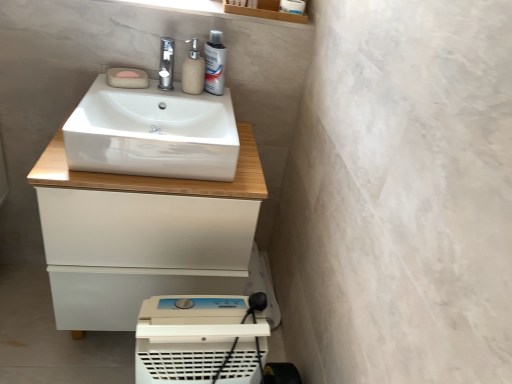
In the scene shown: Measure the distance between point (75, 160) and camera.

A distance of 1.11 meters exists between point (75, 160) and camera.

Describe the element at coordinates (156, 129) in the screenshot. Image resolution: width=512 pixels, height=384 pixels. I see `white glossy sink at center` at that location.

Locate an element on the screen. This screenshot has width=512, height=384. silver metallic mouthwash at upper center is located at coordinates (214, 63).

In order to face beige matte soap at upper left, the first soap when ordered from top to bottom, should I rotate leftwards or rightwards?

Turn left approximately 17.131 degrees to face it.

Image resolution: width=512 pixels, height=384 pixels. What do you see at coordinates (193, 71) in the screenshot?
I see `matte beige soap dispenser at upper center` at bounding box center [193, 71].

What is the approximate width of white plastic air purifier at lower center?

It is 9.65 inches.

Describe the element at coordinates (136, 235) in the screenshot. I see `white glossy cabinet at center` at that location.

Where is `white glossy cabinet at center`? This screenshot has height=384, width=512. white glossy cabinet at center is located at coordinates (136, 235).

I want to click on satin nickel faucet at upper center, so click(x=166, y=64).

Considering the positions of objects white glossy sink at center and pink felt soap at upper left, which is the 2th soap in top-to-bottom order, in the image provided, who is more to the right, white glossy sink at center or pink felt soap at upper left, which is the 2th soap in top-to-bottom order,?

Positioned to the right is white glossy sink at center.

Between white glossy sink at center and pink felt soap at upper left, the first soap in the bottom-to-top sequence, which one has larger size?

Bigger between the two is white glossy sink at center.

Based on the photo, which of these two, white glossy sink at center or pink felt soap at upper left, which is the 2th soap in top-to-bottom order, stands shorter?

With less height is pink felt soap at upper left, which is the 2th soap in top-to-bottom order.

Is white glossy sink at center surrounding pink felt soap at upper left, the first soap in the bottom-to-top sequence?

Yes, pink felt soap at upper left, the first soap in the bottom-to-top sequence, can be found within white glossy sink at center.

From the image's perspective, is white plastic air purifier at lower center positioned above or below satin nickel faucet at upper center?

white plastic air purifier at lower center is below satin nickel faucet at upper center.

Is white plastic air purifier at lower center not within satin nickel faucet at upper center?

white plastic air purifier at lower center is positioned outside satin nickel faucet at upper center.

Could you tell me if white plastic air purifier at lower center is facing satin nickel faucet at upper center?

No, white plastic air purifier at lower center is not facing towards satin nickel faucet at upper center.

You are a GUI agent. You are given a task and a screenshot of the screen. Output one action in this format:
    pyautogui.click(x=<x>, y=<y>)
    Task: Click on the tap behind the white plastic air purifier at lower center
    The height and width of the screenshot is (384, 512).
    Given the screenshot: What is the action you would take?
    pyautogui.click(x=166, y=64)

Is white glossy sink at center far from satin nickel faucet at upper center?

No, white glossy sink at center is not far away from satin nickel faucet at upper center.

Does white glossy sink at center turn towards satin nickel faucet at upper center?

No, white glossy sink at center is not facing towards satin nickel faucet at upper center.

Considering the sizes of objects white glossy sink at center and satin nickel faucet at upper center in the image provided, who is taller, white glossy sink at center or satin nickel faucet at upper center?

white glossy sink at center.

Which object is positioned more to the left, white glossy sink at center or satin nickel faucet at upper center?

Positioned to the left is white glossy sink at center.

Image resolution: width=512 pixels, height=384 pixels. I want to click on sink below the satin nickel faucet at upper center (from the image's perspective), so click(156, 129).

Does satin nickel faucet at upper center have a lesser height compared to white glossy sink at center?

Yes.

Does satin nickel faucet at upper center come in front of white glossy sink at center?

No, satin nickel faucet at upper center is further to the viewer.

Is white glossy sink at center thinner than beige matte soap at upper left, the first soap when ordered from top to bottom?

In fact, white glossy sink at center might be wider than beige matte soap at upper left, the first soap when ordered from top to bottom.

What's the angular difference between white glossy sink at center and beige matte soap at upper left, the first soap when ordered from top to bottom,'s facing directions?

The angular difference between white glossy sink at center and beige matte soap at upper left, the first soap when ordered from top to bottom, is 3.8 degrees.

Consider the image. Does white glossy sink at center have a lesser height compared to beige matte soap at upper left, the first soap when ordered from top to bottom?

In fact, white glossy sink at center may be taller than beige matte soap at upper left, the first soap when ordered from top to bottom.

Considering their positions, is white glossy sink at center located in front of or behind beige matte soap at upper left, the first soap when ordered from top to bottom?

Visually, white glossy sink at center is located in front of beige matte soap at upper left, the first soap when ordered from top to bottom.

Considering the sizes of objects silver metallic mouthwash at upper center and beige matte soap at upper left, which is the second soap in bottom-to-top order, in the image provided, who is thinner, silver metallic mouthwash at upper center or beige matte soap at upper left, which is the second soap in bottom-to-top order,?

beige matte soap at upper left, which is the second soap in bottom-to-top order.

Is silver metallic mouthwash at upper center bigger than beige matte soap at upper left, the first soap when ordered from top to bottom?

Indeed, silver metallic mouthwash at upper center has a larger size compared to beige matte soap at upper left, the first soap when ordered from top to bottom.

From a real-world perspective, is silver metallic mouthwash at upper center on beige matte soap at upper left, the first soap when ordered from top to bottom?

Yes, from a real-world perspective, silver metallic mouthwash at upper center is above beige matte soap at upper left, the first soap when ordered from top to bottom.

Is silver metallic mouthwash at upper center taller than beige matte soap at upper left, the first soap when ordered from top to bottom?

Yes, silver metallic mouthwash at upper center is taller than beige matte soap at upper left, the first soap when ordered from top to bottom.

Is point (136, 76) closer or farther from the camera than point (91, 148)?

Point (136, 76).

Could you tell me if beige matte soap at upper left, the first soap when ordered from top to bottom, is facing white glossy sink at center?

Yes, beige matte soap at upper left, the first soap when ordered from top to bottom, is oriented towards white glossy sink at center.

Is the position of beige matte soap at upper left, the first soap when ordered from top to bottom, more distant than that of white glossy sink at center?

Yes, beige matte soap at upper left, the first soap when ordered from top to bottom, is further from the viewer.

You are a GUI agent. You are given a task and a screenshot of the screen. Output one action in this format:
    pyautogui.click(x=<x>, y=<y>)
    Task: Click on the sink in front of the pink felt soap at upper left, the first soap in the bottom-to-top sequence
    This screenshot has height=384, width=512.
    Given the screenshot: What is the action you would take?
    pyautogui.click(x=156, y=129)

The height and width of the screenshot is (384, 512). Identify the location of appliance below the satin nickel faucet at upper center (from the image's perspective). (198, 340).

When comparing their distances from silver metallic mouthwash at upper center, does beige matte soap at upper left, the first soap when ordered from top to bottom, or white glossy cabinet at center seem closer?

Among the two, beige matte soap at upper left, the first soap when ordered from top to bottom, is located nearer to silver metallic mouthwash at upper center.

Looking at the image, which one is located closer to satin nickel faucet at upper center, white glossy sink at center or white glossy cabinet at center?

The object closer to satin nickel faucet at upper center is white glossy sink at center.

Which object lies further to the anchor point beige matte soap at upper left, which is the second soap in bottom-to-top order, pink felt soap at upper left, which is the 2th soap in top-to-bottom order, or satin nickel faucet at upper center?

satin nickel faucet at upper center lies further to beige matte soap at upper left, which is the second soap in bottom-to-top order, than the other object.

Based on their spatial positions, is beige matte soap at upper left, the first soap when ordered from top to bottom, or satin nickel faucet at upper center closer to matte beige soap dispenser at upper center?

satin nickel faucet at upper center lies closer to matte beige soap dispenser at upper center than the other object.

From the image, which object appears to be farther from white plastic air purifier at lower center, silver metallic mouthwash at upper center or white glossy sink at center?

silver metallic mouthwash at upper center.

Looking at the image, which one is located further to white plastic air purifier at lower center, silver metallic mouthwash at upper center or pink felt soap at upper left, which is the 2th soap in top-to-bottom order?

Based on the image, pink felt soap at upper left, which is the 2th soap in top-to-bottom order, appears to be further to white plastic air purifier at lower center.

Which object lies further to the anchor point matte beige soap dispenser at upper center, white plastic air purifier at lower center or satin nickel faucet at upper center?

white plastic air purifier at lower center is further to matte beige soap dispenser at upper center.

When comparing their distances from white glossy cabinet at center, does beige matte soap at upper left, the first soap when ordered from top to bottom, or white plastic air purifier at lower center seem further?

Based on the image, beige matte soap at upper left, the first soap when ordered from top to bottom, appears to be further to white glossy cabinet at center.

Find the location of a particular element. sink between beige matte soap at upper left, which is the second soap in bottom-to-top order, and white plastic air purifier at lower center, in the vertical direction is located at coordinates (156, 129).

At what (x,y) coordinates should I click in order to perform the action: click on tap located between beige matte soap at upper left, which is the second soap in bottom-to-top order, and matte beige soap dispenser at upper center in the left-right direction. Please return your answer as a coordinate pair (x, y). This screenshot has width=512, height=384. Looking at the image, I should click on (166, 64).

Where is `soap between beige matte soap at upper left, the first soap when ordered from top to bottom, and white plastic air purifier at lower center, in the vertical direction`? Image resolution: width=512 pixels, height=384 pixels. soap between beige matte soap at upper left, the first soap when ordered from top to bottom, and white plastic air purifier at lower center, in the vertical direction is located at coordinates (127, 78).

Find the location of a particular element. The image size is (512, 384). soap dispenser positioned between white glossy sink at center and silver metallic mouthwash at upper center from near to far is located at coordinates (193, 71).